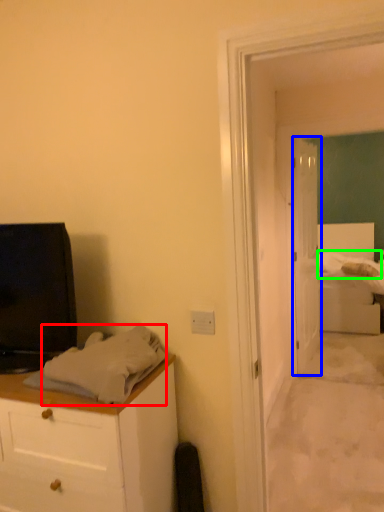
Question: Considering the real-world distances, which object is closest to sheet (highlighted by a red box)? door (highlighted by a blue box) or sheet (highlighted by a green box).

Choices:
 (A) door
 (B) sheet

Answer: (A)